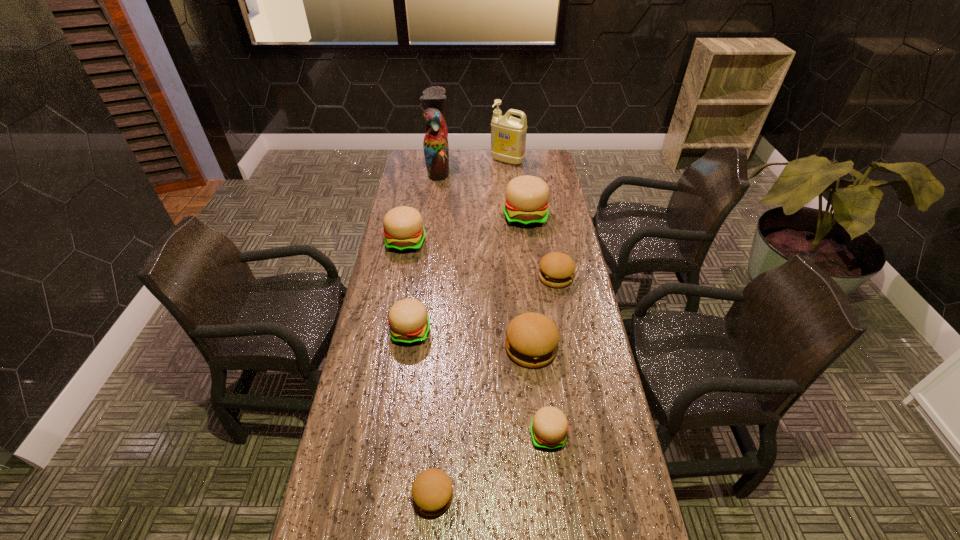
Where is `object that stands as the seventh closest to the nearest brown hamburger`? The width and height of the screenshot is (960, 540). object that stands as the seventh closest to the nearest brown hamburger is located at coordinates (436, 149).

Locate which object is the third closest to the smallest beige hamburger. Please provide its 2D coordinates. Your answer should be formatted as a tuple, i.e. [(x, y)], where the tuple contains the x and y coordinates of a point satisfying the conditions above.

[(409, 324)]

Select which hamburger is the second closest to the beige detergent. Please provide its 2D coordinates. Your answer should be formatted as a tuple, i.e. [(x, y)], where the tuple contains the x and y coordinates of a point satisfying the conditions above.

[(403, 226)]

Locate which hamburger is the third closest to the second tallest hamburger. Please provide its 2D coordinates. Your answer should be formatted as a tuple, i.e. [(x, y)], where the tuple contains the x and y coordinates of a point satisfying the conditions above.

[(557, 269)]

The width and height of the screenshot is (960, 540). Identify the location of the closest beige hamburger to the biggest brown hamburger. (549, 427).

Select which beige hamburger is the fourth closest to the parrot. Please provide its 2D coordinates. Your answer should be formatted as a tuple, i.e. [(x, y)], where the tuple contains the x and y coordinates of a point satisfying the conditions above.

[(549, 427)]

Find the location of `brown hamburger that is the second closest to the second farthest brown hamburger`. brown hamburger that is the second closest to the second farthest brown hamburger is located at coordinates (432, 492).

Choose which brown hamburger is the third nearest neighbor to the tallest hamburger. Please provide its 2D coordinates. Your answer should be formatted as a tuple, i.e. [(x, y)], where the tuple contains the x and y coordinates of a point satisfying the conditions above.

[(432, 492)]

Locate an element on the screen. vacant space that satisfies the following two spatial constraints: 1. on the back side of the nearest hamburger; 2. on the right side of the tallest hamburger is located at coordinates (x=453, y=217).

Where is `free space that satisfies the following two spatial constraints: 1. at the face of the biggest brown hamburger; 2. on the right side of the tallest object`? free space that satisfies the following two spatial constraints: 1. at the face of the biggest brown hamburger; 2. on the right side of the tallest object is located at coordinates (415, 348).